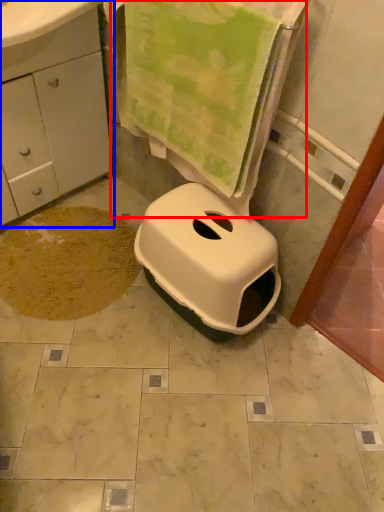
Question: Which of the following is the closest to the observer, beach towel (highlighted by a red box) or bathroom cabinet (highlighted by a blue box)?

Choices:
 (A) beach towel
 (B) bathroom cabinet

Answer: (A)